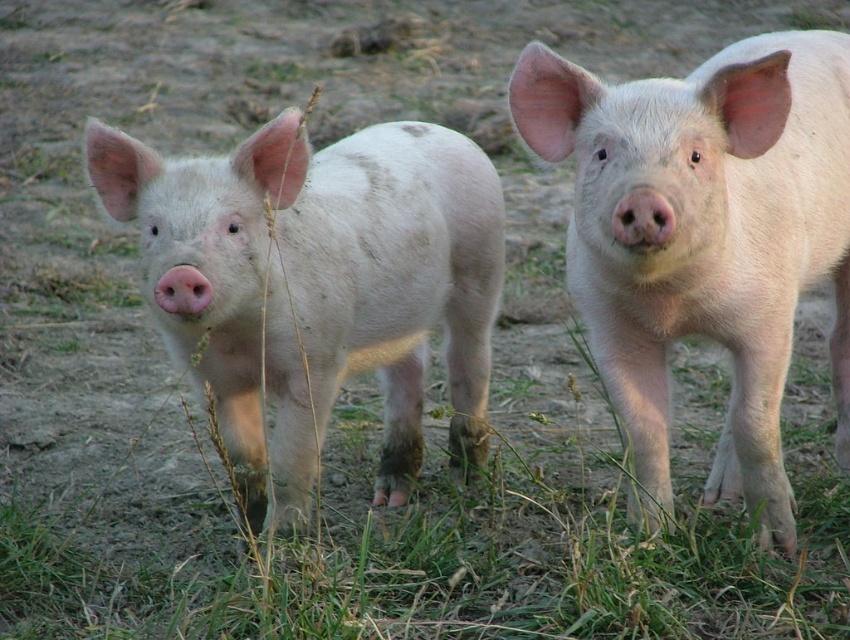
Does point (106, 148) come in front of point (800, 227)?

Yes.

At what (x,y) coordinates should I click in order to perform the action: click on matte white piglet at center. Please return your answer as a coordinate pair (x, y). This screenshot has width=850, height=640. Looking at the image, I should click on (318, 284).

The height and width of the screenshot is (640, 850). What do you see at coordinates (318, 284) in the screenshot?
I see `matte white piglet at center` at bounding box center [318, 284].

What are the coordinates of `matte white piglet at center` in the screenshot? It's located at (318, 284).